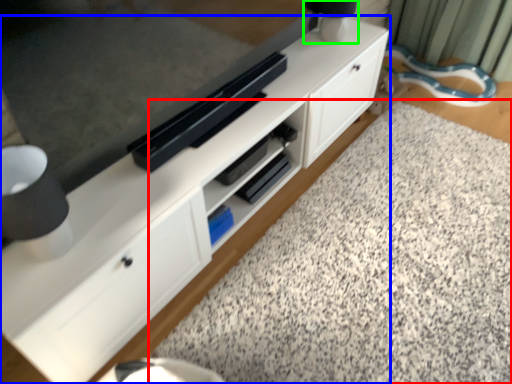
Question: Based on their relative distances, which object is nearer to granite (highlighted by a red box)? Choose from cabinetry (highlighted by a blue box) and table lamp (highlighted by a green box).

Choices:
 (A) cabinetry
 (B) table lamp

Answer: (A)